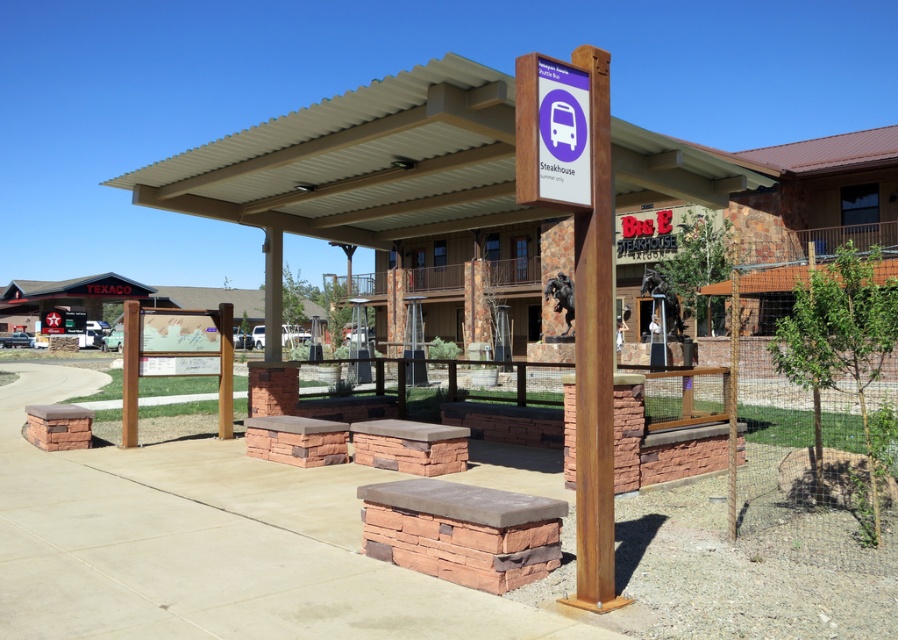
You are at the bus stop and want to place a small potted plant between the rustic wood signpost at center and the brown wood post at center. Can you fit it there if the plant requires 10 cm of space?

The rustic wood signpost at center has a lesser width compared to brown wood post at center. The combined width of both objects would leave enough space for the plant requiring 10 cm, so yes, it can be placed there.

You are standing at the bus stop in front of the Big E Steakhouse. There are two points marked on the ground at coordinates point (606, 582) and point (527, 195). If you want to move closer to the bus stop shelter, which point should you step on?

You should step on point (527, 195) because it is closer to the bus stop shelter than point (606, 582).

You are standing at the bus stop in front of the steakhouse and want to read the sign. Which object is nearer to you, the rustic wood signpost at center or the brown wood post at center?

The rustic wood signpost at center is closer to the viewer than the brown wood post at center, so you can read it more easily.